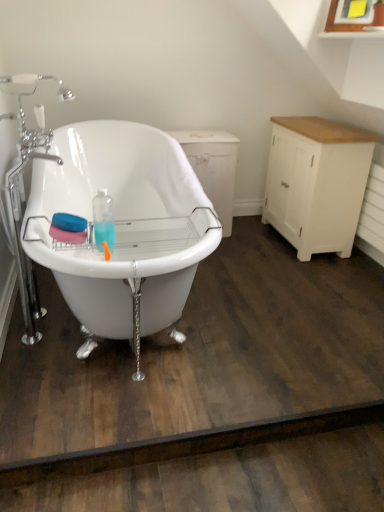
Describe the element at coordinates (213, 167) in the screenshot. I see `white wood dresser at right` at that location.

Measure the distance between point (310, 169) and camera.

Point (310, 169) is 2.37 meters from camera.

Identify the location of white glossy bathtub at center. The width and height of the screenshot is (384, 512). (122, 227).

Does white glossy bathtub at center have a lesser height compared to white painted wood cabinet at right?

No, white glossy bathtub at center is not shorter than white painted wood cabinet at right.

Is white painted wood cabinet at right located within white glossy bathtub at center?

No, white painted wood cabinet at right is not surrounded by white glossy bathtub at center.

From the picture: From a real-world perspective, is white glossy bathtub at center beneath white painted wood cabinet at right?

Actually, white glossy bathtub at center is physically above white painted wood cabinet at right in the real world.

Is white painted wood cabinet at right aimed at white wood dresser at right?

Yes.

Looking at this image, considering the sizes of objects white painted wood cabinet at right and white wood dresser at right in the image provided, who is wider, white painted wood cabinet at right or white wood dresser at right?

white wood dresser at right is wider.

From the image's perspective, which is below, white painted wood cabinet at right or white wood dresser at right?

white painted wood cabinet at right is shown below in the image.

Based on the photo, is white painted wood cabinet at right inside or outside of white glossy bathtub at center?

white painted wood cabinet at right exists outside the volume of white glossy bathtub at center.

How different are the orientations of white painted wood cabinet at right and white glossy bathtub at center in degrees?

The angle between the facing direction of white painted wood cabinet at right and the facing direction of white glossy bathtub at center is 180 degrees.

From the image's perspective, is white painted wood cabinet at right on top of white glossy bathtub at center?

Yes.

From a real-world perspective, is white painted wood cabinet at right positioned above or below white glossy bathtub at center?

From a real-world perspective, white painted wood cabinet at right is physically below white glossy bathtub at center.

Considering the points (212, 205) and (202, 169), which point is in front, point (212, 205) or point (202, 169)?

The point (202, 169) is in front.

Considering the relative sizes of white glossy bathtub at center and white wood dresser at right in the image provided, is white glossy bathtub at center bigger than white wood dresser at right?

Indeed, white glossy bathtub at center has a larger size compared to white wood dresser at right.

From a real-world perspective, is white glossy bathtub at center over white wood dresser at right?

Yes, from a real-world perspective, white glossy bathtub at center is on top of white wood dresser at right.

How different are the orientations of white glossy bathtub at center and white wood dresser at right in degrees?

They differ by 89.9 degrees in their facing directions.

From a real-world perspective, which is physically above, white wood dresser at right or white glossy bathtub at center?

white glossy bathtub at center, from a real-world perspective.

From the image's perspective, which one is positioned higher, white wood dresser at right or white glossy bathtub at center?

white wood dresser at right is shown above in the image.

Which object is more forward, white wood dresser at right or white glossy bathtub at center?

white glossy bathtub at center is more forward.

Considering the relative positions of white wood dresser at right and white painted wood cabinet at right in the image provided, is white wood dresser at right to the left or to the right of white painted wood cabinet at right?

white wood dresser at right is positioned on white painted wood cabinet at right's left side.

Is white wood dresser at right not close to white painted wood cabinet at right?

No.

Where is `cabinetry above the white wood dresser at right (from a real-world perspective)`? The height and width of the screenshot is (512, 384). cabinetry above the white wood dresser at right (from a real-world perspective) is located at coordinates (316, 183).

The height and width of the screenshot is (512, 384). Identify the location of cabinetry below the white glossy bathtub at center (from a real-world perspective). (316, 183).

Find the location of a particular element. The height and width of the screenshot is (512, 384). cabinetry located above the white wood dresser at right (from a real-world perspective) is located at coordinates (316, 183).

Considering their positions, is white glossy bathtub at center positioned closer to white wood dresser at right than white painted wood cabinet at right?

white painted wood cabinet at right is positioned closer to the anchor white wood dresser at right.

When comparing their distances from white painted wood cabinet at right, does white wood dresser at right or white glossy bathtub at center seem closer?

white wood dresser at right is closer to white painted wood cabinet at right.

From the image, which object appears to be farther from white painted wood cabinet at right, white glossy bathtub at center or white wood dresser at right?

Based on the image, white glossy bathtub at center appears to be further to white painted wood cabinet at right.

From the picture: Based on their spatial positions, is white painted wood cabinet at right or white glossy bathtub at center further from white wood dresser at right?

white glossy bathtub at center.

Looking at this image, which object lies nearer to the anchor point white glossy bathtub at center, white painted wood cabinet at right or white wood dresser at right?

white wood dresser at right lies closer to white glossy bathtub at center than the other object.

Based on the photo, estimate the real-world distances between objects in this image. Which object is further from white glossy bathtub at center, white wood dresser at right or white painted wood cabinet at right?

white painted wood cabinet at right.

Identify the location of cabinetry positioned between white glossy bathtub at center and white wood dresser at right from near to far. The height and width of the screenshot is (512, 384). (316, 183).